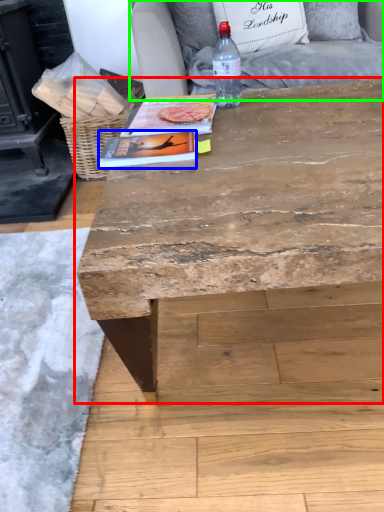
Question: Which object is the closest to the table (highlighted by a red box)? Choose among these: magazine (highlighted by a blue box) or armchair (highlighted by a green box).

Choices:
 (A) magazine
 (B) armchair

Answer: (A)